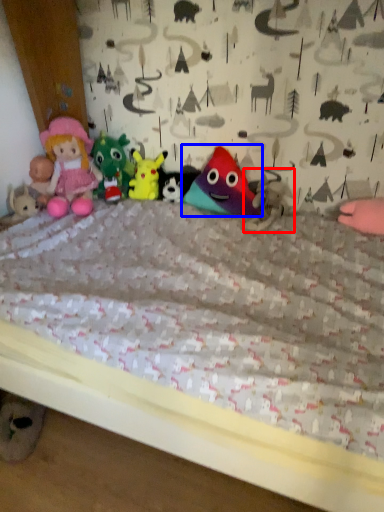
Question: Which of the following is the farthest to the observer, toy (highlighted by a red box) or toy (highlighted by a blue box)?

Choices:
 (A) toy
 (B) toy

Answer: (B)